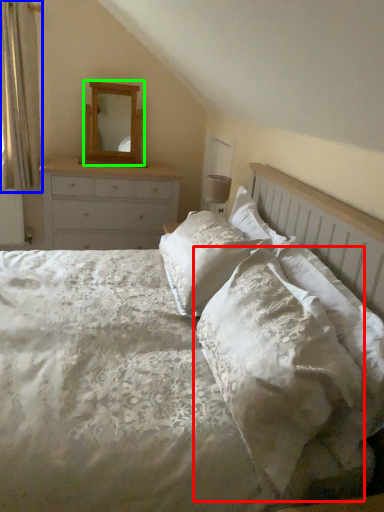
Question: Which object is the closest to the pillow (highlighted by a red box)? Choose among these: curtain (highlighted by a blue box) or mirror (highlighted by a green box).

Choices:
 (A) curtain
 (B) mirror

Answer: (B)